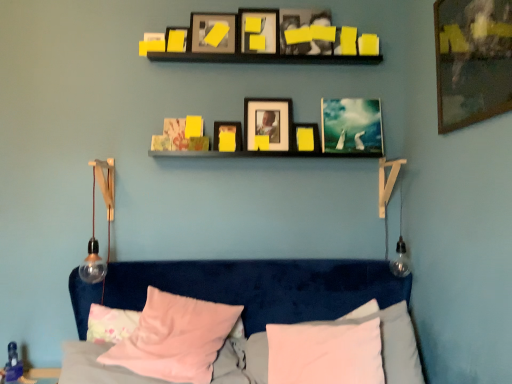
Question: In which direction should I rotate to look at matte black picture frame at upper center, the fifth picture frame viewed from the front?

Choices:
 (A) right
 (B) left

Answer: (A)

Question: Is pink fabric pillow at lower left, the 3th pillow when ordered from right to left, not close to clear glass bulb at left?

Choices:
 (A) no
 (B) yes

Answer: (A)

Question: From a real-world perspective, is pink fabric pillow at lower left, the 3th pillow when ordered from right to left, located beneath clear glass bulb at left?

Choices:
 (A) no
 (B) yes

Answer: (B)

Question: Does pink fabric pillow at lower left, which ranks as the 1th pillow in left-to-right order, have a greater width compared to clear glass bulb at left?

Choices:
 (A) yes
 (B) no

Answer: (B)

Question: From the image's perspective, is pink fabric pillow at lower left, which ranks as the 1th pillow in left-to-right order, located above clear glass bulb at left?

Choices:
 (A) no
 (B) yes

Answer: (A)

Question: Is pink fabric pillow at lower left, which ranks as the 1th pillow in left-to-right order, shorter than clear glass bulb at left?

Choices:
 (A) no
 (B) yes

Answer: (B)

Question: Considering the relative positions of pink fabric pillow at lower left, the 3th pillow when ordered from right to left, and clear glass bulb at left in the image provided, is pink fabric pillow at lower left, the 3th pillow when ordered from right to left, to the right of clear glass bulb at left from the viewer's perspective?

Choices:
 (A) yes
 (B) no

Answer: (A)

Question: From the image's perspective, would you say metallic silver picture frame at center, the ninth picture frame when ordered from front to back, is positioned over clear glass bulb at left?

Choices:
 (A) yes
 (B) no

Answer: (A)

Question: Is clear glass bulb at left located within metallic silver picture frame at center, the ninth picture frame when ordered from front to back?

Choices:
 (A) no
 (B) yes

Answer: (A)

Question: Can you confirm if metallic silver picture frame at center, the 1th picture frame in the back-to-front sequence, is smaller than clear glass bulb at left?

Choices:
 (A) yes
 (B) no

Answer: (A)

Question: From a real-world perspective, is metallic silver picture frame at center, the ninth picture frame when ordered from front to back, on clear glass bulb at left?

Choices:
 (A) no
 (B) yes

Answer: (B)

Question: Is metallic silver picture frame at center, the ninth picture frame when ordered from front to back, behind clear glass bulb at left?

Choices:
 (A) yes
 (B) no

Answer: (A)

Question: Can you confirm if metallic silver picture frame at center, the ninth picture frame when ordered from front to back, is taller than clear glass bulb at left?

Choices:
 (A) no
 (B) yes

Answer: (A)

Question: Is matte yellow picture frame at center, the fourth picture frame from the back, touching pink fabric pillow at lower center, placed as the second pillow when sorted from right to left?

Choices:
 (A) no
 (B) yes

Answer: (A)